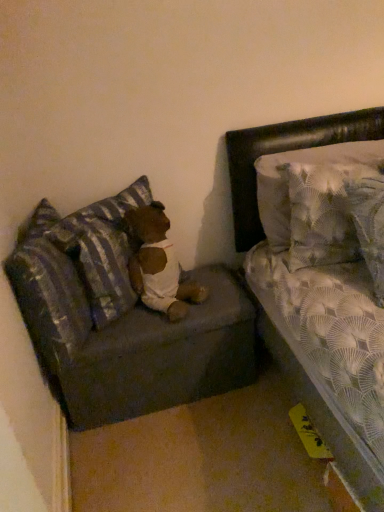
Question: From the image's perspective, is striped fabric pillow at left, which appears as the second pillow when viewed from the left, below striped fabric pillow at left, which appears as the 3th pillow when viewed from the right?

Choices:
 (A) yes
 (B) no

Answer: (B)

Question: Can you confirm if striped fabric pillow at left, which appears as the second pillow when viewed from the left, is smaller than striped fabric pillow at left, positioned as the first pillow in left-to-right order?

Choices:
 (A) no
 (B) yes

Answer: (B)

Question: Is striped fabric pillow at left, which appears as the second pillow when viewed from the left, facing away from striped fabric pillow at left, which appears as the 3th pillow when viewed from the right?

Choices:
 (A) yes
 (B) no

Answer: (A)

Question: Does striped fabric pillow at left, which appears as the second pillow when viewed from the right, have a larger size compared to striped fabric pillow at left, positioned as the first pillow in left-to-right order?

Choices:
 (A) yes
 (B) no

Answer: (B)

Question: Considering the relative positions of striped fabric pillow at left, which appears as the second pillow when viewed from the left, and striped fabric pillow at left, positioned as the first pillow in left-to-right order, in the image provided, is striped fabric pillow at left, which appears as the second pillow when viewed from the left, to the right of striped fabric pillow at left, positioned as the first pillow in left-to-right order, from the viewer's perspective?

Choices:
 (A) no
 (B) yes

Answer: (B)

Question: Would you say patterned fabric pillow at upper right, which is counted as the first pillow, starting from the right, is to the left or to the right of striped fabric pillow at left, which appears as the 3th pillow when viewed from the right, in the picture?

Choices:
 (A) left
 (B) right

Answer: (B)

Question: From a real-world perspective, is patterned fabric pillow at upper right, which is counted as the third pillow, starting from the left, positioned above or below striped fabric pillow at left, positioned as the first pillow in left-to-right order?

Choices:
 (A) above
 (B) below

Answer: (A)

Question: From their relative heights in the image, would you say patterned fabric pillow at upper right, which is counted as the first pillow, starting from the right, is taller or shorter than striped fabric pillow at left, which appears as the 3th pillow when viewed from the right?

Choices:
 (A) short
 (B) tall

Answer: (B)

Question: Looking at their shapes, would you say patterned fabric pillow at upper right, which is counted as the third pillow, starting from the left, is wider or thinner than striped fabric pillow at left, positioned as the first pillow in left-to-right order?

Choices:
 (A) wide
 (B) thin

Answer: (A)

Question: Is point (145, 271) positioned closer to the camera than point (284, 220)?

Choices:
 (A) farther
 (B) closer

Answer: (A)

Question: Based on their sizes in the image, would you say brown plush teddy bear at center is bigger or smaller than patterned fabric pillow at upper right, which is counted as the first pillow, starting from the right?

Choices:
 (A) big
 (B) small

Answer: (B)

Question: Is brown plush teddy bear at center wider or thinner than patterned fabric pillow at upper right, which is counted as the third pillow, starting from the left?

Choices:
 (A) thin
 (B) wide

Answer: (B)

Question: Considering the relative positions of brown plush teddy bear at center and patterned fabric pillow at upper right, which is counted as the third pillow, starting from the left, in the image provided, is brown plush teddy bear at center to the left or to the right of patterned fabric pillow at upper right, which is counted as the third pillow, starting from the left,?

Choices:
 (A) right
 (B) left

Answer: (B)

Question: From a real-world perspective, is dark gray fabric couch at lower left above or below patterned fabric pillow at upper right, which is counted as the third pillow, starting from the left?

Choices:
 (A) above
 (B) below

Answer: (B)

Question: From the image's perspective, is dark gray fabric couch at lower left above or below patterned fabric pillow at upper right, which is counted as the third pillow, starting from the left?

Choices:
 (A) below
 (B) above

Answer: (A)